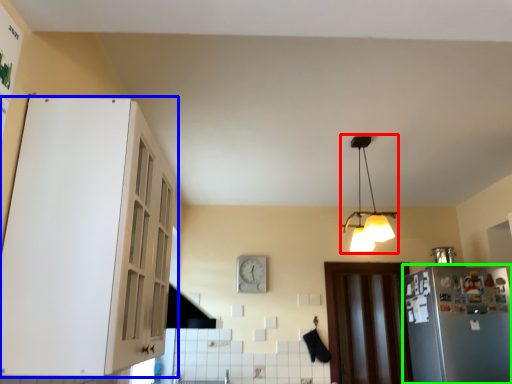
Question: Which is nearer to the lamp (highlighted by a red box)? cabinetry (highlighted by a blue box) or refrigerator (highlighted by a green box).

Choices:
 (A) cabinetry
 (B) refrigerator

Answer: (B)